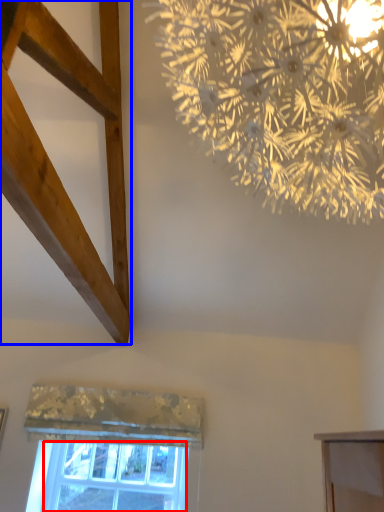
Question: Which point is further to the camera, window screen (highlighted by a red box) or plank (highlighted by a blue box)?

Choices:
 (A) window screen
 (B) plank

Answer: (A)